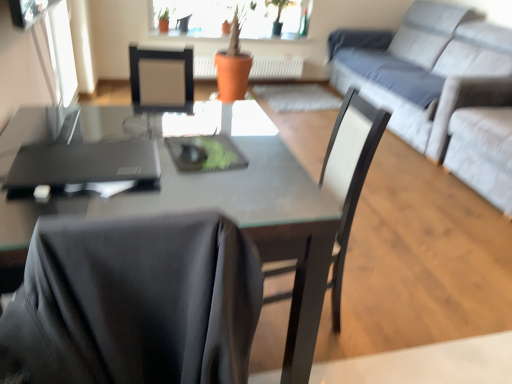
Question: Should I look upward or downward to see matte black desk at center?

Choices:
 (A) up
 (B) down

Answer: (B)

Question: Can you confirm if transparent glass window screen at upper left is thinner than black matte laptop at left?

Choices:
 (A) no
 (B) yes

Answer: (B)

Question: Is transparent glass window screen at upper left oriented away from black matte laptop at left?

Choices:
 (A) no
 (B) yes

Answer: (A)

Question: Is transparent glass window screen at upper left further to camera compared to black matte laptop at left?

Choices:
 (A) no
 (B) yes

Answer: (B)

Question: Is transparent glass window screen at upper left aimed at black matte laptop at left?

Choices:
 (A) yes
 (B) no

Answer: (B)

Question: Is transparent glass window screen at upper left closer to the viewer compared to black matte laptop at left?

Choices:
 (A) yes
 (B) no

Answer: (B)

Question: Would you say transparent glass window screen at upper left contains black matte laptop at left?

Choices:
 (A) no
 (B) yes

Answer: (A)

Question: Can you confirm if transparent glass window screen at upper left is positioned to the right of black matte chair at center?

Choices:
 (A) no
 (B) yes

Answer: (A)

Question: Is transparent glass window screen at upper left surrounding black matte chair at center?

Choices:
 (A) yes
 (B) no

Answer: (B)

Question: Is transparent glass window screen at upper left facing towards black matte chair at center?

Choices:
 (A) yes
 (B) no

Answer: (B)

Question: Is transparent glass window screen at upper left shorter than black matte chair at center?

Choices:
 (A) no
 (B) yes

Answer: (B)

Question: From the image's perspective, is transparent glass window screen at upper left below black matte chair at center?

Choices:
 (A) no
 (B) yes

Answer: (A)

Question: Does transparent glass window screen at upper left have a lesser width compared to black matte chair at center?

Choices:
 (A) no
 (B) yes

Answer: (B)

Question: Considering the relative sizes of black matte laptop at left and transparent glass window screen at upper left in the image provided, is black matte laptop at left thinner than transparent glass window screen at upper left?

Choices:
 (A) yes
 (B) no

Answer: (B)